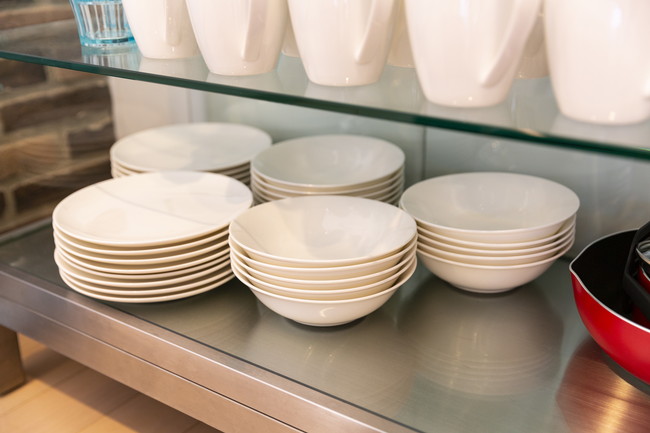
What are the coordinates of `bricks on the wall` in the screenshot? It's located at (21, 150), (47, 179), (84, 145), (53, 101), (67, 74), (29, 72), (21, 16), (6, 211).